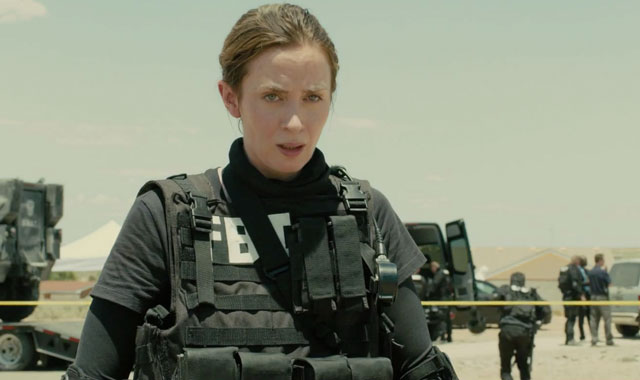
Locate an element on the screen. open door is located at coordinates (458, 247).